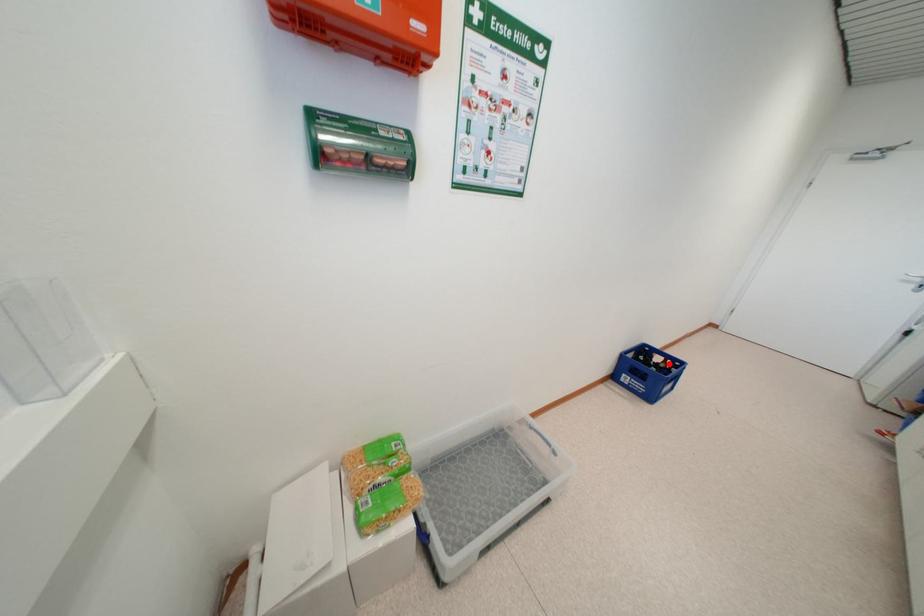
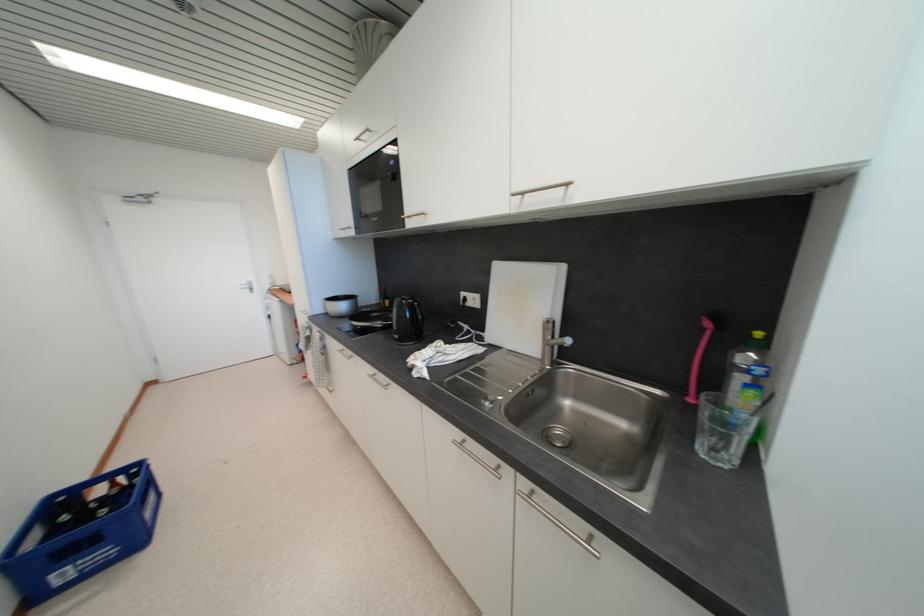
Question: I am providing you with two images of the same scene from different viewpoints. Given a red point in image1, look at the same physical point in image2. Is it:

Choices:
 (A) Closer to the viewpoint
 (B) Farther from the viewpoint

Answer: (A)